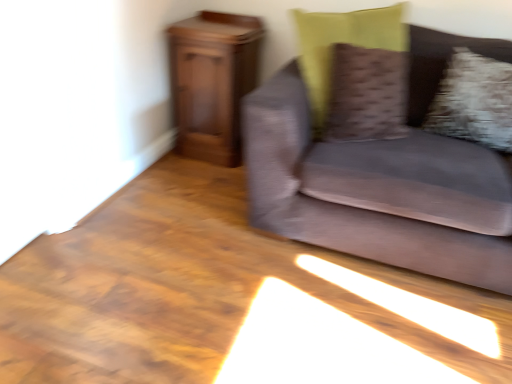
The width and height of the screenshot is (512, 384). In order to click on fluffy white pillow at right, the 1th pillow viewed from the right in this screenshot , I will do `click(474, 101)`.

Where is `wooden cabinet at left`? wooden cabinet at left is located at coordinates (212, 82).

Where is `textured brown pillow at upper right, which appears as the first pillow when viewed from the left`? Image resolution: width=512 pixels, height=384 pixels. textured brown pillow at upper right, which appears as the first pillow when viewed from the left is located at coordinates (343, 42).

Considering the points (457, 109) and (333, 39), which point is in front, point (457, 109) or point (333, 39)?

Positioned in front is point (457, 109).

What's the angular difference between fluffy white pillow at right, arranged as the 2th pillow when viewed from the left, and textured brown pillow at upper right, which appears as the first pillow when viewed from the left,'s facing directions?

The angular difference between fluffy white pillow at right, arranged as the 2th pillow when viewed from the left, and textured brown pillow at upper right, which appears as the first pillow when viewed from the left, is 43.3 degrees.

How far apart are fluffy white pillow at right, arranged as the 2th pillow when viewed from the left, and textured brown pillow at upper right, which appears as the first pillow when viewed from the left?

fluffy white pillow at right, arranged as the 2th pillow when viewed from the left, and textured brown pillow at upper right, which appears as the first pillow when viewed from the left, are 39.98 centimeters apart.

Does fluffy white pillow at right, arranged as the 2th pillow when viewed from the left, turn towards textured brown pillow at upper right, the 2th pillow when ordered from right to left?

No, fluffy white pillow at right, arranged as the 2th pillow when viewed from the left, is not aimed at textured brown pillow at upper right, the 2th pillow when ordered from right to left.

At what (x,y) coordinates should I click in order to perform the action: click on furniture behind the textured brown pillow at upper right, which appears as the first pillow when viewed from the left. Please return your answer as a coordinate pair (x, y). Looking at the image, I should click on (212, 82).

Which of these two, wooden cabinet at left or textured brown pillow at upper right, the 2th pillow when ordered from right to left, is wider?

wooden cabinet at left is wider.

Could textured brown pillow at upper right, which appears as the first pillow when viewed from the left, be considered to be inside wooden cabinet at left?

No.

Is wooden cabinet at left next to textured brown pillow at upper right, the 2th pillow when ordered from right to left, and touching it?

wooden cabinet at left and textured brown pillow at upper right, the 2th pillow when ordered from right to left, are not in contact.

Can textured brown pillow at upper right, the 2th pillow when ordered from right to left, be found inside velvet gray couch at right?

Absolutely, textured brown pillow at upper right, the 2th pillow when ordered from right to left, is inside velvet gray couch at right.

Considering the sizes of velvet gray couch at right and textured brown pillow at upper right, which appears as the first pillow when viewed from the left, in the image, is velvet gray couch at right bigger or smaller than textured brown pillow at upper right, which appears as the first pillow when viewed from the left,?

Considering their sizes, velvet gray couch at right takes up more space than textured brown pillow at upper right, which appears as the first pillow when viewed from the left.

Can you confirm if velvet gray couch at right is shorter than textured brown pillow at upper right, which appears as the first pillow when viewed from the left?

Incorrect, the height of velvet gray couch at right does not fall short of that of textured brown pillow at upper right, which appears as the first pillow when viewed from the left.

From a real-world perspective, is velvet gray couch at right above or below textured brown pillow at upper right, which appears as the first pillow when viewed from the left?

velvet gray couch at right is situated lower than textured brown pillow at upper right, which appears as the first pillow when viewed from the left, in the real world.

Is textured brown pillow at upper right, which appears as the first pillow when viewed from the left, facing towards wooden cabinet at left?

No, textured brown pillow at upper right, which appears as the first pillow when viewed from the left, does not turn towards wooden cabinet at left.

From a real-world perspective, is textured brown pillow at upper right, which appears as the first pillow when viewed from the left, physically below wooden cabinet at left?

Incorrect, from a real-world perspective, textured brown pillow at upper right, which appears as the first pillow when viewed from the left, is higher than wooden cabinet at left.

Would you say textured brown pillow at upper right, which appears as the first pillow when viewed from the left, is to the left or to the right of wooden cabinet at left in the picture?

textured brown pillow at upper right, which appears as the first pillow when viewed from the left, is to the right of wooden cabinet at left.

Can you confirm if textured brown pillow at upper right, which appears as the first pillow when viewed from the left, is shorter than velvet gray couch at right?

Indeed, textured brown pillow at upper right, which appears as the first pillow when viewed from the left, has a lesser height compared to velvet gray couch at right.

Can you tell me how much textured brown pillow at upper right, which appears as the first pillow when viewed from the left, and velvet gray couch at right differ in facing direction?

There is a 40-degree angle between the facing directions of textured brown pillow at upper right, which appears as the first pillow when viewed from the left, and velvet gray couch at right.

From a real-world perspective, which is physically below, textured brown pillow at upper right, the 2th pillow when ordered from right to left, or velvet gray couch at right?

velvet gray couch at right, from a real-world perspective.

Based on the photo, which of these two, fluffy white pillow at right, the 1th pillow viewed from the right, or wooden cabinet at left, stands taller?

Standing taller between the two is wooden cabinet at left.

Would you say fluffy white pillow at right, the 1th pillow viewed from the right, is to the left or to the right of wooden cabinet at left in the picture?

fluffy white pillow at right, the 1th pillow viewed from the right, is to the right of wooden cabinet at left.

How different are the orientations of fluffy white pillow at right, the 1th pillow viewed from the right, and wooden cabinet at left in degrees?

The angular difference between fluffy white pillow at right, the 1th pillow viewed from the right, and wooden cabinet at left is 3.62 degrees.

Looking at this image, can you confirm if fluffy white pillow at right, the 1th pillow viewed from the right, is thinner than wooden cabinet at left?

Yes.

Is point (218, 102) more distant than point (459, 99)?

That is True.

Is wooden cabinet at left outside of fluffy white pillow at right, the 1th pillow viewed from the right?

wooden cabinet at left is positioned outside fluffy white pillow at right, the 1th pillow viewed from the right.

Considering the relative sizes of wooden cabinet at left and fluffy white pillow at right, arranged as the 2th pillow when viewed from the left, in the image provided, is wooden cabinet at left wider than fluffy white pillow at right, arranged as the 2th pillow when viewed from the left,?

Correct, the width of wooden cabinet at left exceeds that of fluffy white pillow at right, arranged as the 2th pillow when viewed from the left.

In the scene shown: From a real-world perspective, is wooden cabinet at left above or below fluffy white pillow at right, the 1th pillow viewed from the right?

wooden cabinet at left is situated lower than fluffy white pillow at right, the 1th pillow viewed from the right, in the real world.

This screenshot has height=384, width=512. I want to click on pillow that is above the fluffy white pillow at right, arranged as the 2th pillow when viewed from the left (from the image's perspective), so click(343, 42).

Where is `furniture behind the textured brown pillow at upper right, which appears as the first pillow when viewed from the left`? This screenshot has width=512, height=384. furniture behind the textured brown pillow at upper right, which appears as the first pillow when viewed from the left is located at coordinates (212, 82).

Considering their positions, is fluffy white pillow at right, arranged as the 2th pillow when viewed from the left, positioned closer to velvet gray couch at right than wooden cabinet at left?

Among the two, fluffy white pillow at right, arranged as the 2th pillow when viewed from the left, is located nearer to velvet gray couch at right.

Which object lies further to the anchor point wooden cabinet at left, textured brown pillow at upper right, which appears as the first pillow when viewed from the left, or velvet gray couch at right?

velvet gray couch at right is positioned further to the anchor wooden cabinet at left.

Based on their spatial positions, is velvet gray couch at right or textured brown pillow at upper right, which appears as the first pillow when viewed from the left, closer to fluffy white pillow at right, arranged as the 2th pillow when viewed from the left?

Based on the image, velvet gray couch at right appears to be nearer to fluffy white pillow at right, arranged as the 2th pillow when viewed from the left.

From the image, which object appears to be nearer to wooden cabinet at left, textured brown pillow at upper right, the 2th pillow when ordered from right to left, or fluffy white pillow at right, the 1th pillow viewed from the right?

textured brown pillow at upper right, the 2th pillow when ordered from right to left.

Considering their positions, is velvet gray couch at right positioned closer to textured brown pillow at upper right, the 2th pillow when ordered from right to left, than wooden cabinet at left?

Based on the image, velvet gray couch at right appears to be nearer to textured brown pillow at upper right, the 2th pillow when ordered from right to left.

Which object lies further to the anchor point velvet gray couch at right, fluffy white pillow at right, the 1th pillow viewed from the right, or textured brown pillow at upper right, the 2th pillow when ordered from right to left?

The object further to velvet gray couch at right is fluffy white pillow at right, the 1th pillow viewed from the right.

Estimate the real-world distances between objects in this image. Which object is further from wooden cabinet at left, fluffy white pillow at right, the 1th pillow viewed from the right, or velvet gray couch at right?

fluffy white pillow at right, the 1th pillow viewed from the right.

Estimate the real-world distances between objects in this image. Which object is further from textured brown pillow at upper right, the 2th pillow when ordered from right to left, fluffy white pillow at right, arranged as the 2th pillow when viewed from the left, or velvet gray couch at right?

The object further to textured brown pillow at upper right, the 2th pillow when ordered from right to left, is fluffy white pillow at right, arranged as the 2th pillow when viewed from the left.

Identify the location of pillow between wooden cabinet at left and fluffy white pillow at right, the 1th pillow viewed from the right, from left to right. (343, 42).

Find the location of a particular element. pillow located between wooden cabinet at left and velvet gray couch at right in the left-right direction is located at coordinates (343, 42).

Find the location of a particular element. pillow positioned between velvet gray couch at right and fluffy white pillow at right, the 1th pillow viewed from the right, from near to far is located at coordinates (343, 42).

The height and width of the screenshot is (384, 512). What are the coordinates of `studio couch between wooden cabinet at left and fluffy white pillow at right, the 1th pillow viewed from the right, in the horizontal direction` in the screenshot? It's located at (377, 191).